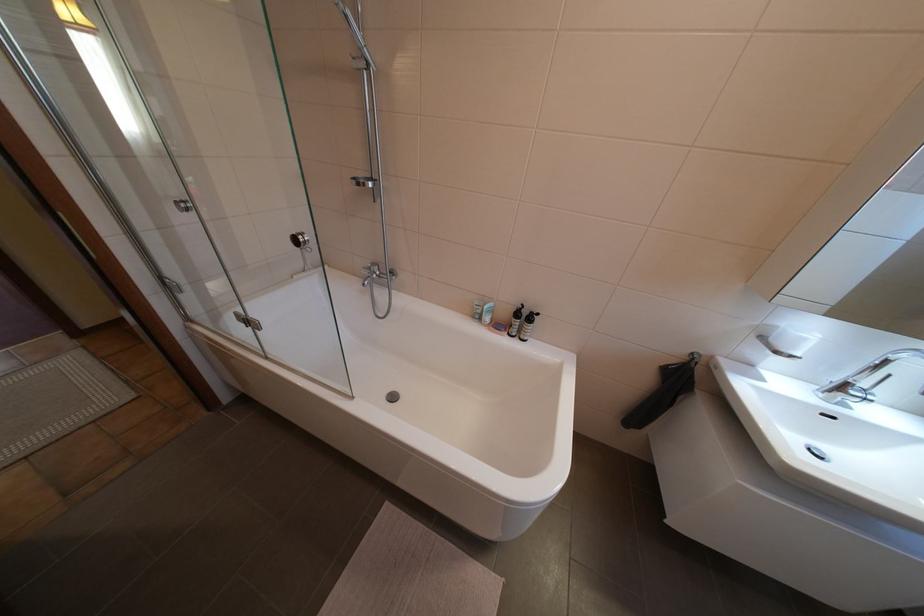
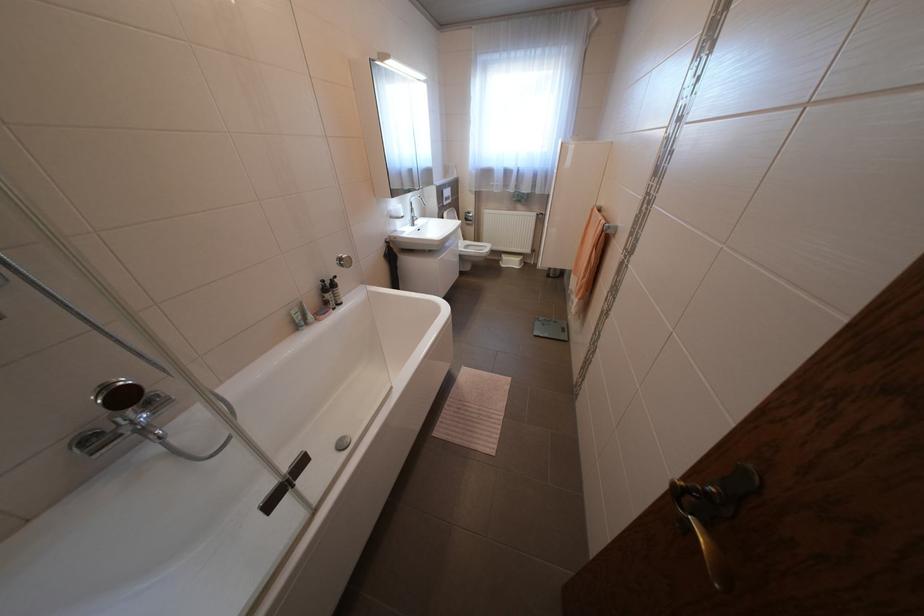
Locate, in the second image, the point that corresponds to point (801, 355) in the first image.

(412, 216)